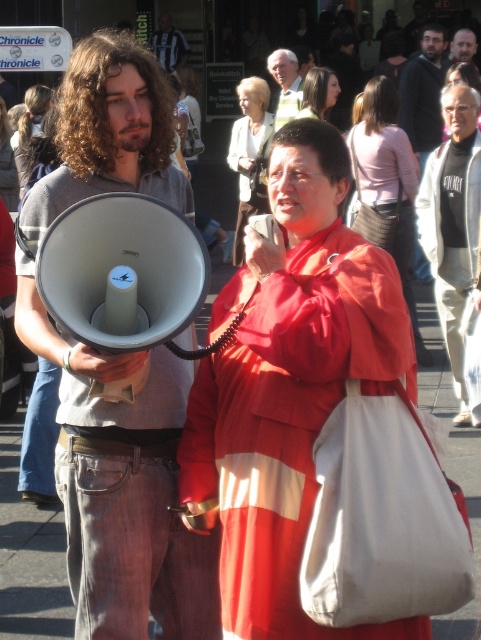
You are standing in the street scene and want to take a photo that includes both the person with the megaphone and the person with the microphone. Which of the two points, point 1 at coordinates [338,200] or point 2 at coordinates [456,44], should you focus on to ensure both subjects are in sharp focus?

You should focus on point 1 at coordinates [338,200] because it is closer to the camera than point 2 at coordinates [456,44], ensuring better focus on both subjects.

You are a photographer trying to capture a clear shot of both the matte black megaphone at center and the smooth skin face at upper right. Which object should you focus on first to ensure it appears sharp in your photo?

The matte black megaphone at center is closer to the viewer than the smooth skin face at upper right, so you should focus on the matte black megaphone at center first to ensure it appears sharp.

You are a photographer trying to capture both the matte black megaphone at center and the smooth skin face at upper right in a single frame. Given their sizes, which object should you focus on to ensure both are clearly visible in your photo?

The matte black megaphone at center has a smaller width than the smooth skin face at upper right. To ensure both are clearly visible, focus on the matte black megaphone at center since it is narrower and can be framed alongside the larger face without overcrowding the composition.